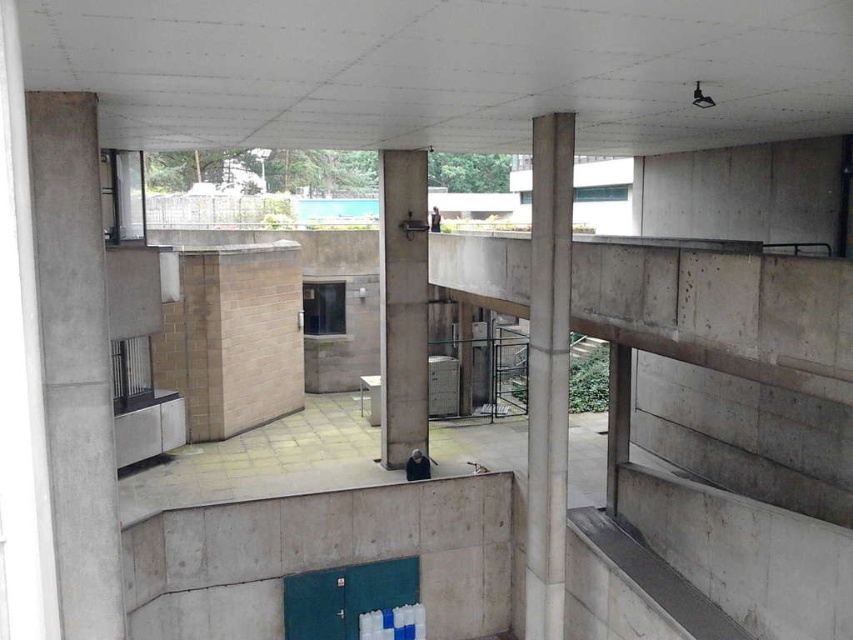
Does smooth concrete pillar at center-right have a lesser width compared to concrete pillar at center?

Indeed, smooth concrete pillar at center-right has a lesser width compared to concrete pillar at center.

Measure the distance between point (x=538, y=154) and camera.

A distance of 33.79 feet exists between point (x=538, y=154) and camera.

Describe the element at coordinates (548, 371) in the screenshot. The image size is (853, 640). I see `smooth concrete pillar at center-right` at that location.

What are the coordinates of `smooth concrete pillar at center-right` in the screenshot? It's located at (548, 371).

Find the location of a particular element. This screenshot has width=853, height=640. concrete at left is located at coordinates (x=74, y=358).

Between point (36, 125) and point (422, 262), which one is positioned behind?

The point (422, 262) is more distant.

Who is more distant from viewer, (109,621) or (421,384)?

The point (421,384) is more distant.

Locate an element on the screen. The width and height of the screenshot is (853, 640). concrete at left is located at coordinates (74, 358).

Who is taller, concrete at left or smooth concrete pillar at center-right?

With more height is smooth concrete pillar at center-right.

Consider the image. Is concrete at left above smooth concrete pillar at center-right?

Indeed, concrete at left is positioned over smooth concrete pillar at center-right.

The height and width of the screenshot is (640, 853). What do you see at coordinates (74, 358) in the screenshot? I see `concrete at left` at bounding box center [74, 358].

Where is `concrete at left`? This screenshot has width=853, height=640. concrete at left is located at coordinates (74, 358).